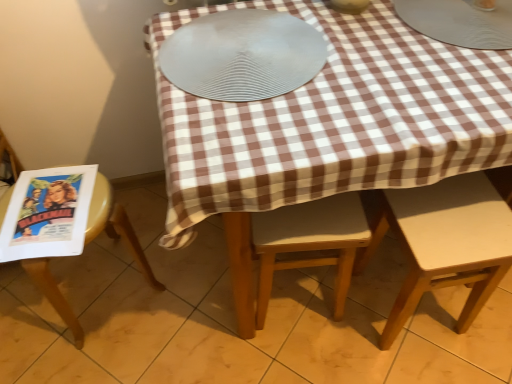
At what (x,y) coordinates should I click in order to perform the action: click on free space that is in between light brown wooden chair at center, placed as the second chair when sorted from left to right, and white matte chair at lower right, marked as the 3th chair in a left-to-right arrangement. Please return your answer as a coordinate pair (x, y). This screenshot has width=512, height=384. Looking at the image, I should click on (349, 318).